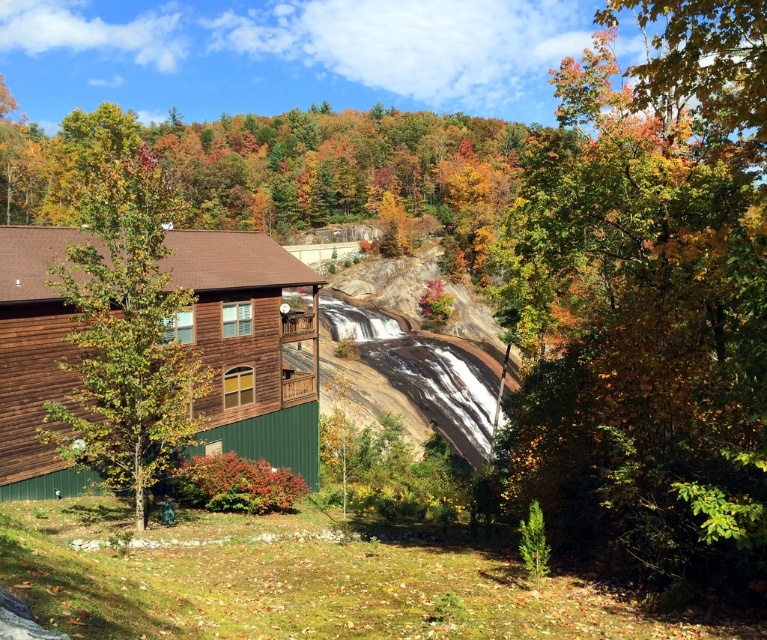
Question: Is autumn leaves at right below green matte tree at center?

Choices:
 (A) no
 (B) yes

Answer: (A)

Question: Estimate the real-world distances between objects in this image. Which object is closer to the green matte tree at center?

Choices:
 (A) brown wood cabin at left
 (B) autumn leaves at right

Answer: (A)

Question: Which point is closer to the camera?

Choices:
 (A) (48, 236)
 (B) (749, 17)
 (C) (107, 259)

Answer: (B)

Question: Among these objects, which one is nearest to the camera?

Choices:
 (A) autumn leaves at right
 (B) brown wood cabin at left
 (C) green matte tree at center

Answer: (A)

Question: Is autumn leaves at right positioned before brown wood cabin at left?

Choices:
 (A) no
 (B) yes

Answer: (B)

Question: Is autumn leaves at right wider than brown wood cabin at left?

Choices:
 (A) yes
 (B) no

Answer: (A)